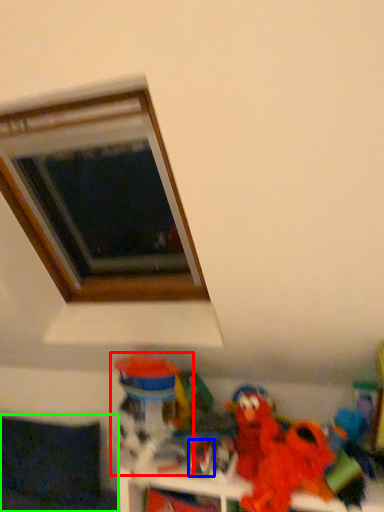
Question: Which object is positioned closest to toy (highlighted by a red box)? Select from toy (highlighted by a blue box) and couch (highlighted by a green box).

Choices:
 (A) toy
 (B) couch

Answer: (A)